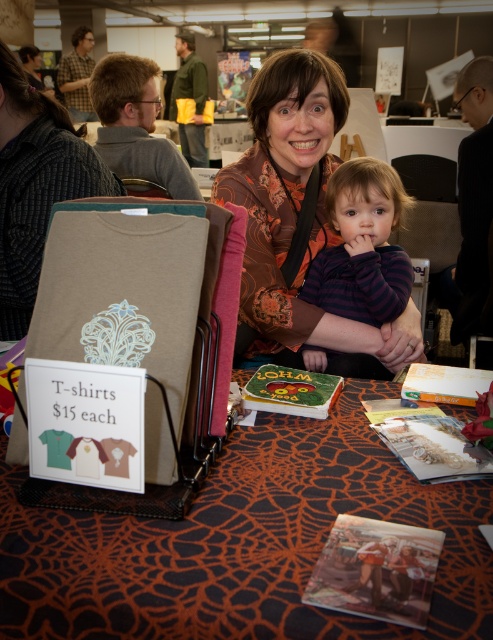
Can you confirm if matte orange blouse at center is positioned below purple striped sweater at center?

No, matte orange blouse at center is not below purple striped sweater at center.

Is matte orange blouse at center positioned before purple striped sweater at center?

Yes.

Locate an element on the screen. matte orange blouse at center is located at coordinates (296, 216).

At what (x,y) coordinates should I click in order to perform the action: click on orange spiderweb fabric at center. Please return your answer as a coordinate pair (x, y). Looking at the image, I should click on (243, 544).

Does orange spiderweb fabric at center appear on the left side of matte orange blouse at center?

Indeed, orange spiderweb fabric at center is positioned on the left side of matte orange blouse at center.

Which is in front, point (116, 544) or point (402, 330)?

Point (116, 544) is more forward.

Identify the location of orange spiderweb fabric at center. (243, 544).

Which is above, orange spiderweb fabric at center or purple striped sweater at center?

purple striped sweater at center

Is orange spiderweb fabric at center to the left of purple striped sweater at center from the viewer's perspective?

Yes, orange spiderweb fabric at center is to the left of purple striped sweater at center.

What do you see at coordinates (243, 544) in the screenshot? The image size is (493, 640). I see `orange spiderweb fabric at center` at bounding box center [243, 544].

This screenshot has height=640, width=493. I want to click on orange spiderweb fabric at center, so click(243, 544).